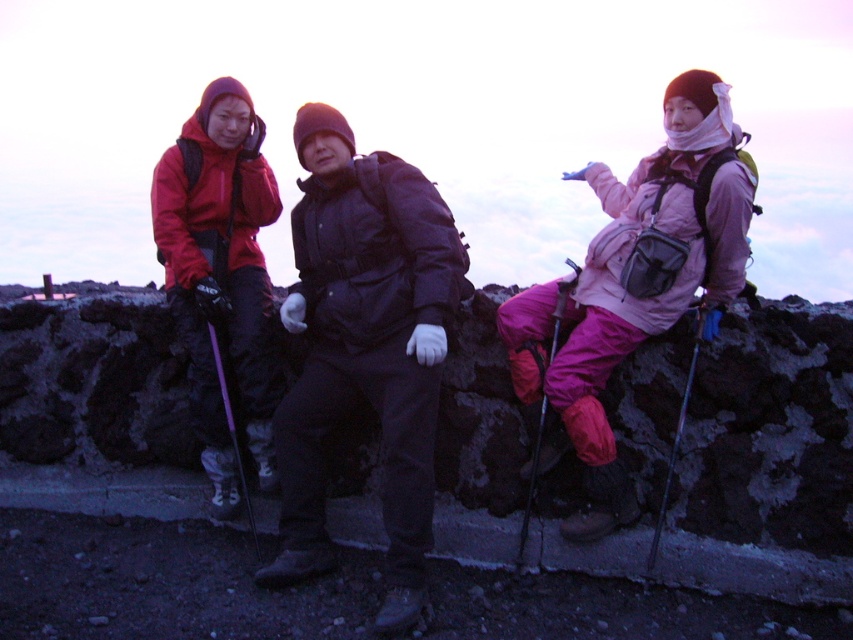
You are planning to take a photo of the matte black jacket at center and the metallic silver ski pole at right. Based on their positions, which object should you focus on first if you want to capture both in a single frame without moving the camera?

You should focus on the matte black jacket at center first because it is positioned to the left of the metallic silver ski pole at right, so adjusting the camera to include both would require ensuring the left side has enough space.

You are planning to take a photo of the matte black jacket at center and the metallic silver ski pole at right. Based on their positions, which object should be placed in the foreground to ensure both are in focus?

The metallic silver ski pole at right should be placed in the foreground because the matte black jacket at center is located above it, so positioning the ski pole closer to the camera will help keep both in focus.